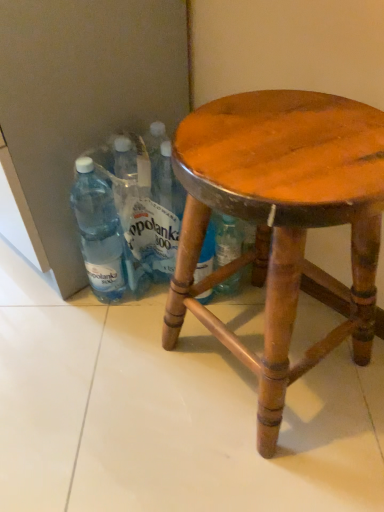
I want to click on free region on the left part of wooden stool at center, so click(x=120, y=382).